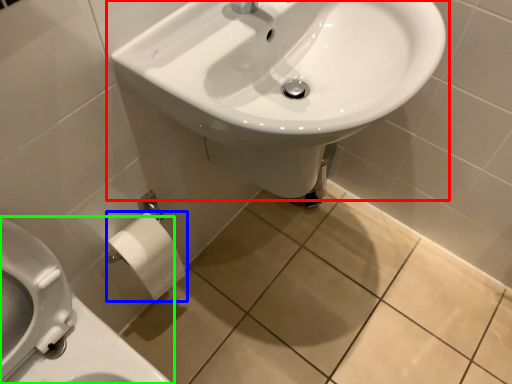
Question: Which object is positioned closest to sink (highlighted by a red box)? Select from toilet paper (highlighted by a blue box) and toilet (highlighted by a green box).

Choices:
 (A) toilet paper
 (B) toilet

Answer: (A)